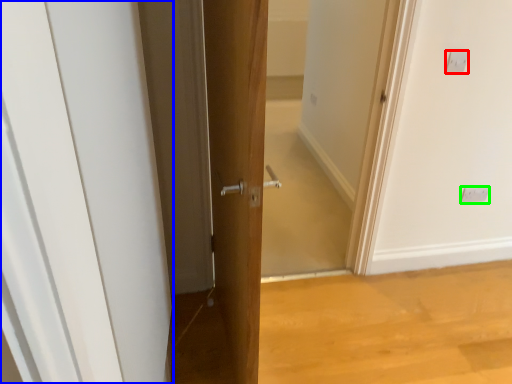
Question: Which object is the closest to the electric outlet (highlighted by a red box)? Choose among these: door (highlighted by a blue box) or electric outlet (highlighted by a green box).

Choices:
 (A) door
 (B) electric outlet

Answer: (B)